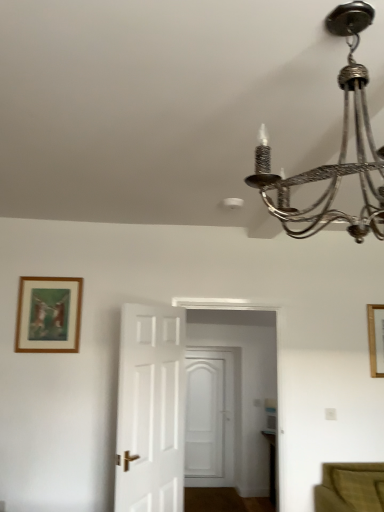
Question: Is metallic chandelier at upper right positioned with its back to white wooden door at center, marked as the 1th door in a back-to-front arrangement?

Choices:
 (A) no
 (B) yes

Answer: (A)

Question: Is metallic chandelier at upper right next to white wooden door at center, the first door when ordered from right to left, and touching it?

Choices:
 (A) yes
 (B) no

Answer: (B)

Question: Is metallic chandelier at upper right positioned beyond the bounds of white wooden door at center, which appears as the 2th door when viewed from the left?

Choices:
 (A) no
 (B) yes

Answer: (B)

Question: Is there a large distance between metallic chandelier at upper right and white wooden door at center, which appears as the 2th door when viewed from the left?

Choices:
 (A) no
 (B) yes

Answer: (B)

Question: Is metallic chandelier at upper right at the right side of white wooden door at center, which appears as the 2th door when viewed from the left?

Choices:
 (A) no
 (B) yes

Answer: (B)

Question: Considering the positions of point (230, 396) and point (370, 326), is point (230, 396) closer or farther from the camera than point (370, 326)?

Choices:
 (A) farther
 (B) closer

Answer: (A)

Question: Would you say white wooden door at center, which appears as the 2th door when viewed from the left, is inside or outside wooden picture frame at upper right, the 2th picture frame when ordered from front to back?

Choices:
 (A) inside
 (B) outside

Answer: (B)

Question: Is white wooden door at center, which appears as the 2th door when viewed from the left, wider or thinner than wooden picture frame at upper right, which is counted as the second picture frame, starting from the left?

Choices:
 (A) wide
 (B) thin

Answer: (A)

Question: Relative to wooden picture frame at upper right, which ranks as the 1th picture frame in right-to-left order, is white wooden door at center, which appears as the 2th door when viewed from the left, in front or behind?

Choices:
 (A) front
 (B) behind

Answer: (B)

Question: From the image's perspective, is white wooden door at center, which appears as the 2th door when viewed from the left, positioned above or below metallic chandelier at upper right?

Choices:
 (A) below
 (B) above

Answer: (A)

Question: In the image, is white wooden door at center, the first door when ordered from right to left, on the left side or the right side of metallic chandelier at upper right?

Choices:
 (A) left
 (B) right

Answer: (A)

Question: Considering the positions of white wooden door at center, which appears as the 2th door when viewed from the left, and metallic chandelier at upper right in the image, is white wooden door at center, which appears as the 2th door when viewed from the left, wider or thinner than metallic chandelier at upper right?

Choices:
 (A) thin
 (B) wide

Answer: (A)

Question: Considering the positions of point (187, 456) and point (352, 61), is point (187, 456) closer or farther from the camera than point (352, 61)?

Choices:
 (A) closer
 (B) farther

Answer: (B)

Question: From the image's perspective, is wooden picture frame at upper right, the 2th picture frame when ordered from front to back, located above or below white wooden door at center, the first door when ordered from right to left?

Choices:
 (A) above
 (B) below

Answer: (A)

Question: Is wooden picture frame at upper right, which ranks as the 1th picture frame in right-to-left order, wider or thinner than white wooden door at center, which appears as the 2th door when viewed from the left?

Choices:
 (A) wide
 (B) thin

Answer: (B)